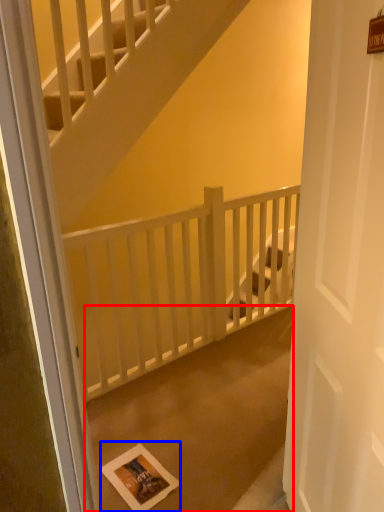
Question: Which point is further to the camera, concrete (highlighted by a red box) or postcard (highlighted by a blue box)?

Choices:
 (A) concrete
 (B) postcard

Answer: (B)